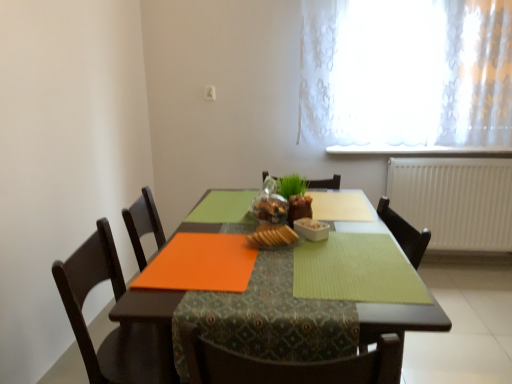
Question: Considering the relative sizes of slightly toasted bread at center and white plastic radiator at right in the image provided, is slightly toasted bread at center bigger than white plastic radiator at right?

Choices:
 (A) no
 (B) yes

Answer: (A)

Question: Considering the relative sizes of slightly toasted bread at center and white plastic radiator at right in the image provided, is slightly toasted bread at center shorter than white plastic radiator at right?

Choices:
 (A) yes
 (B) no

Answer: (A)

Question: Considering the relative sizes of slightly toasted bread at center and white plastic radiator at right in the image provided, is slightly toasted bread at center taller than white plastic radiator at right?

Choices:
 (A) yes
 (B) no

Answer: (B)

Question: Does slightly toasted bread at center appear on the right side of white plastic radiator at right?

Choices:
 (A) yes
 (B) no

Answer: (B)

Question: Is slightly toasted bread at center thinner than white plastic radiator at right?

Choices:
 (A) yes
 (B) no

Answer: (B)

Question: Does point (317, 284) appear closer or farther from the camera than point (339, 33)?

Choices:
 (A) closer
 (B) farther

Answer: (A)

Question: From the image's perspective, is green textured placemat at center, the 2th place mat viewed from the left, positioned above or below translucent fabric at upper right?

Choices:
 (A) below
 (B) above

Answer: (A)

Question: Is green textured placemat at center, the 2th place mat viewed from the left, to the left or to the right of translucent fabric at upper right in the image?

Choices:
 (A) right
 (B) left

Answer: (B)

Question: In terms of size, does green textured placemat at center, which ranks as the first place mat in right-to-left order, appear bigger or smaller than translucent fabric at upper right?

Choices:
 (A) big
 (B) small

Answer: (B)

Question: Considering their positions, is slightly toasted bread at center located in front of or behind orange matte placemat at center?

Choices:
 (A) behind
 (B) front

Answer: (A)

Question: Does point (284, 241) appear closer or farther from the camera than point (151, 319)?

Choices:
 (A) closer
 (B) farther

Answer: (B)

Question: In terms of height, does slightly toasted bread at center look taller or shorter compared to orange matte placemat at center?

Choices:
 (A) short
 (B) tall

Answer: (A)

Question: Based on their sizes in the image, would you say slightly toasted bread at center is bigger or smaller than orange matte placemat at center?

Choices:
 (A) big
 (B) small

Answer: (B)

Question: Is green textured placemat at center, which ranks as the first place mat in right-to-left order, inside or outside of orange matte placemat at center, the second place mat in the right-to-left sequence?

Choices:
 (A) inside
 (B) outside

Answer: (B)

Question: In terms of height, does green textured placemat at center, the 2th place mat viewed from the left, look taller or shorter compared to orange matte placemat at center, which is counted as the first place mat, starting from the left?

Choices:
 (A) tall
 (B) short

Answer: (B)